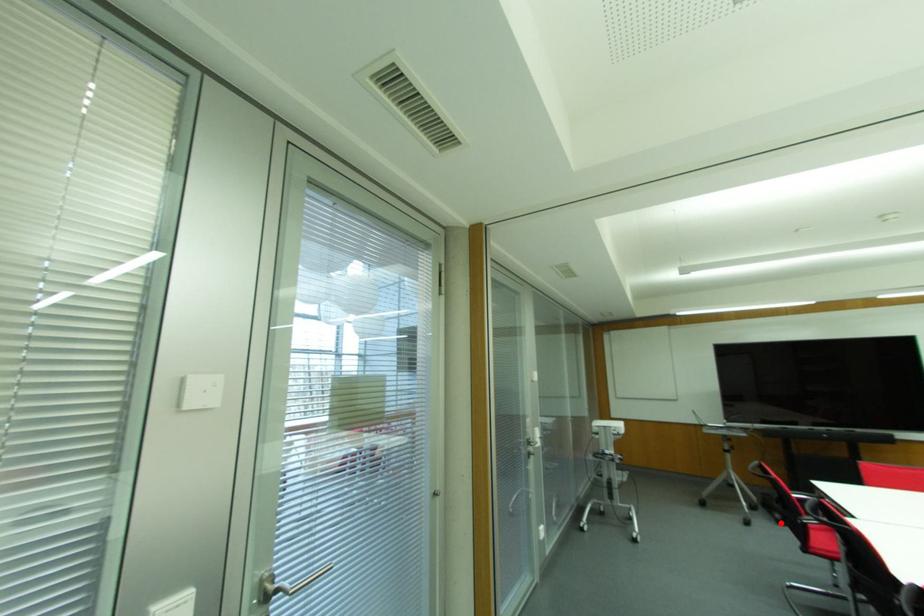
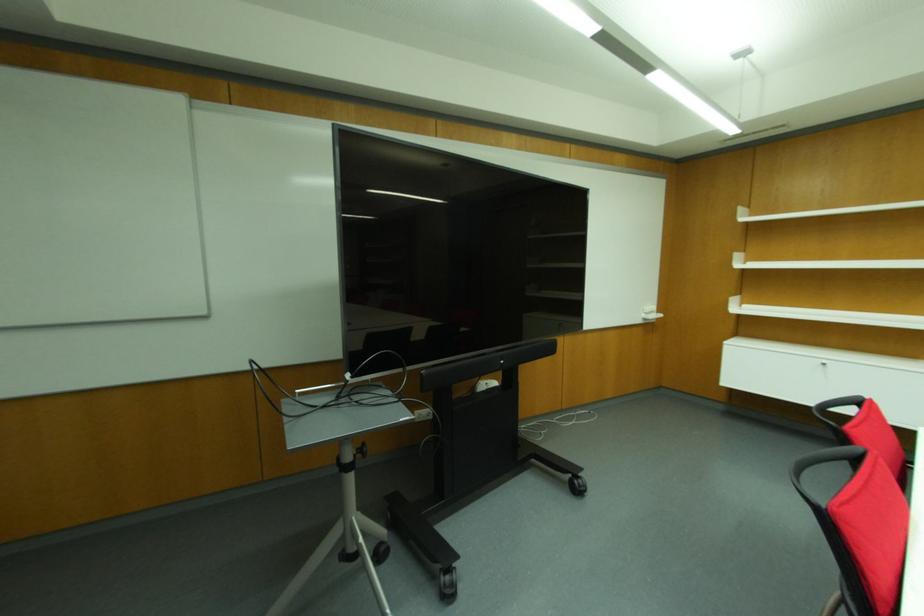
Locate, in the second image, the point that corresponds to the highlighted location in the first image.

(448, 594)